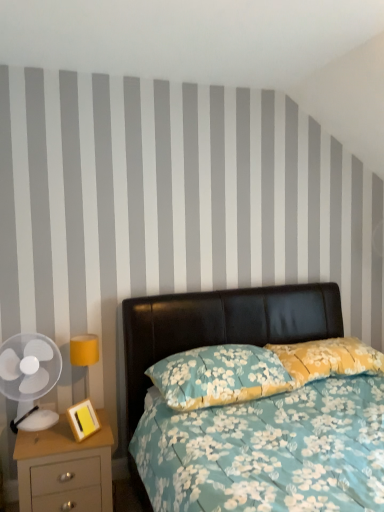
Question: From the image's perspective, is transparent plastic fan at left positioned above or below matte yellow lampshade at left?

Choices:
 (A) below
 (B) above

Answer: (B)

Question: Is transparent plastic fan at left to the left or to the right of matte yellow lampshade at left in the image?

Choices:
 (A) left
 (B) right

Answer: (A)

Question: Which of these objects is positioned closest to the floral fabric bed at center?

Choices:
 (A) beige wood nightstand at lower left
 (B) floral fabric pillow at center, the second pillow from the left
 (C) wooden/yellow picture frame at lower left
 (D) transparent plastic fan at left
 (E) matte yellow lampshade at left

Answer: (B)

Question: Which of these objects is positioned farthest from the floral fabric pillow at center, which is the first pillow from left to right?

Choices:
 (A) transparent plastic fan at left
 (B) beige wood nightstand at lower left
 (C) matte yellow lampshade at left
 (D) floral fabric bed at center
 (E) wooden/yellow picture frame at lower left

Answer: (A)